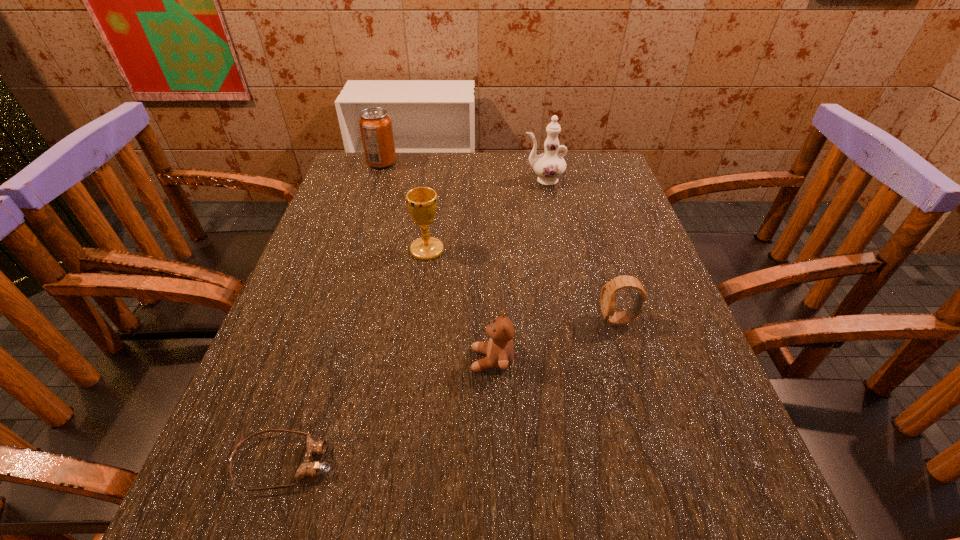
Locate an element on the screen. This screenshot has width=960, height=540. free space located 0.230m at the spout of the chinaware is located at coordinates (443, 180).

At what (x,y) coordinates should I click in order to perform the action: click on free space located at the spout of the chinaware. Please return your answer as a coordinate pair (x, y). The height and width of the screenshot is (540, 960). Looking at the image, I should click on (425, 180).

The image size is (960, 540). What are the coordinates of `free space located 0.390m at the spout of the chinaware` in the screenshot? It's located at (387, 180).

The width and height of the screenshot is (960, 540). What are the coordinates of `free region located on the right of the farthest object` in the screenshot? It's located at (433, 163).

The width and height of the screenshot is (960, 540). I want to click on free space located 0.310m on the back of the fourth object from right to left, so click(438, 174).

The image size is (960, 540). Find the location of `vacant space located 0.360m on the front-facing side of the teddy bear`. vacant space located 0.360m on the front-facing side of the teddy bear is located at coordinates (275, 360).

Where is `free space located 0.380m on the front-facing side of the teddy bear`? free space located 0.380m on the front-facing side of the teddy bear is located at coordinates pos(263,360).

In order to click on vacant space located on the front-facing side of the teddy bear in this screenshot , I will do `click(269, 360)`.

What are the coordinates of `vacant area situated 0.280m on the face of the fourth farthest object` in the screenshot? It's located at (459, 320).

Locate an element on the screen. The image size is (960, 540). free space located 0.050m on the face of the fourth farthest object is located at coordinates (574, 320).